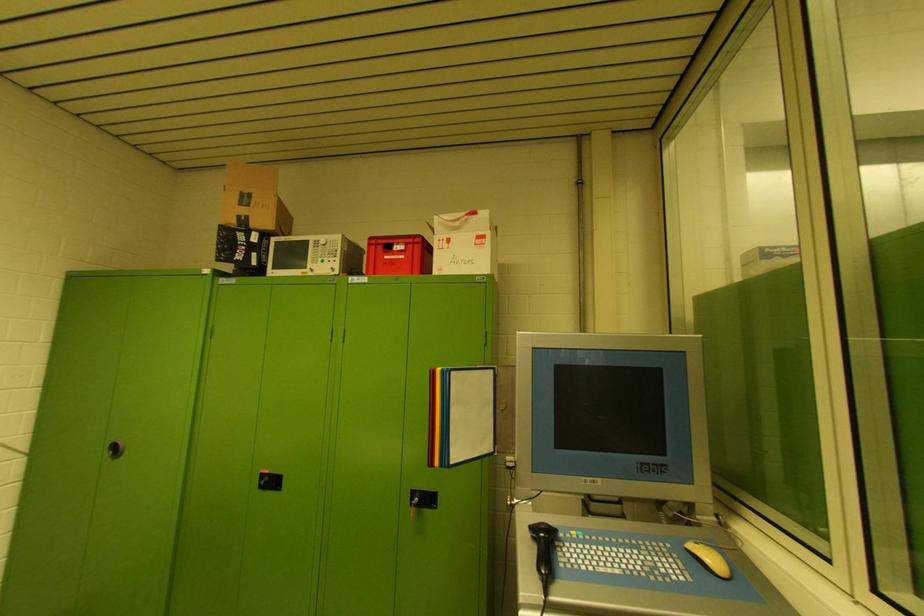
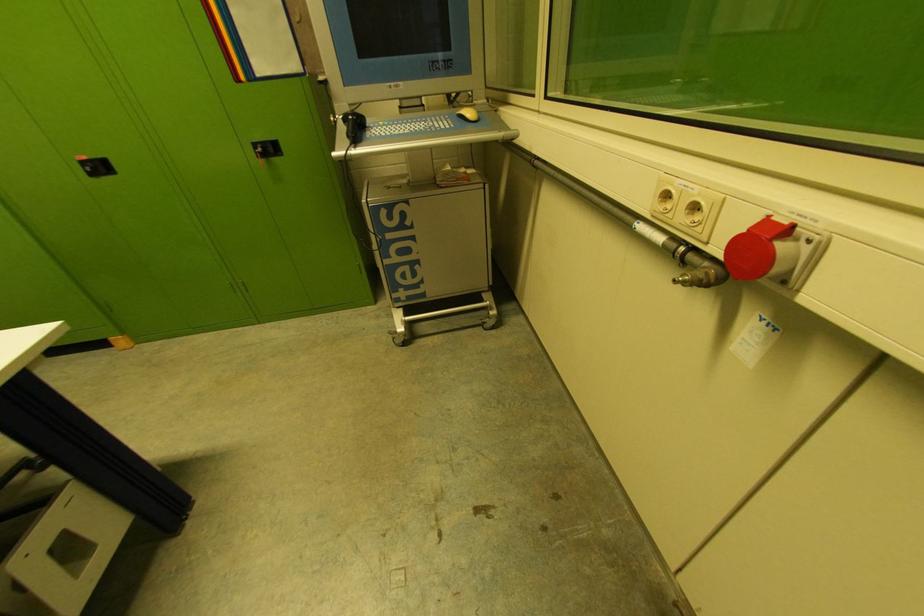
The first image is from the beginning of the video and the second image is from the end. How did the camera likely rotate when shooting the video?

The rotation direction of the camera is right-down.